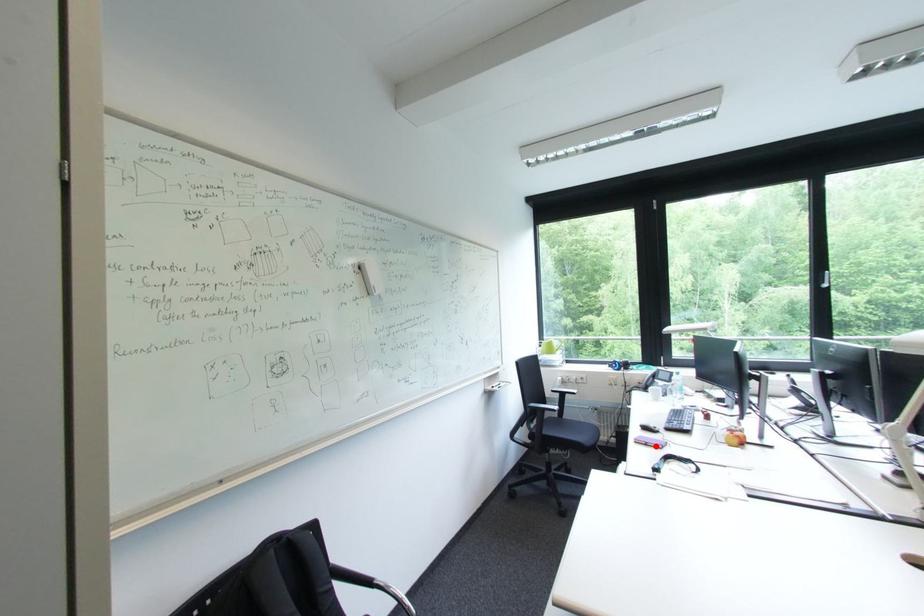
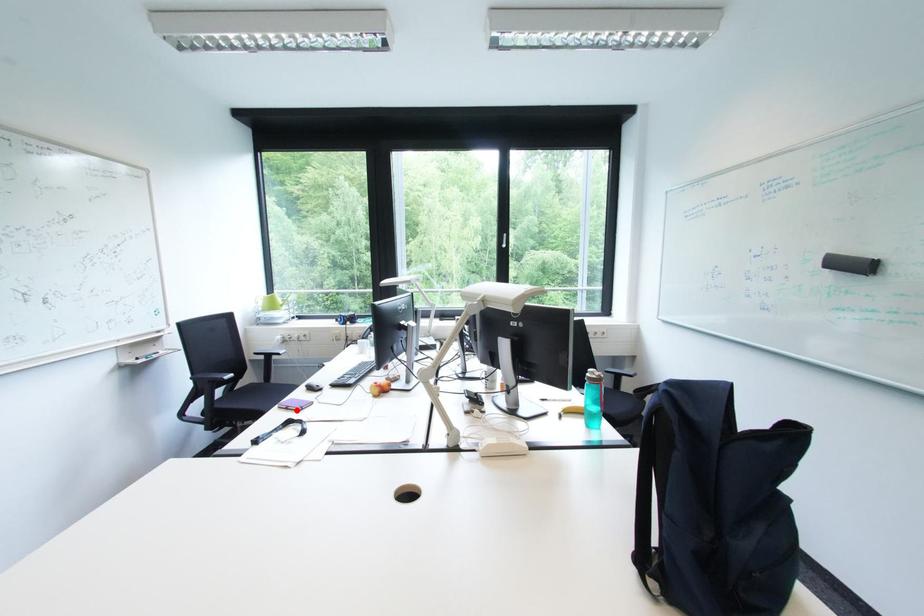
I am providing you with two images of the same scene from different viewpoints. A red point is marked on the first image and another point is marked on the second image. Are the points marked in image1 and image2 representing the same 3D position?

Yes